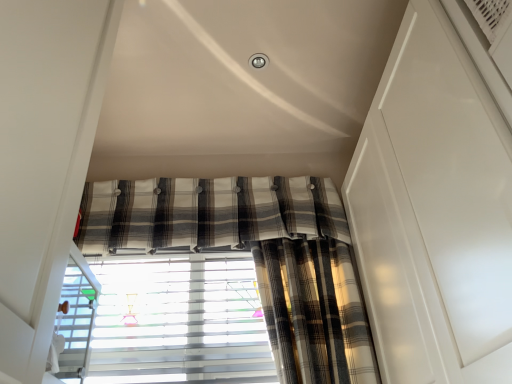
Question: From their relative heights in the image, would you say white textured blinds at center is taller or shorter than plaid fabric curtain at center?

Choices:
 (A) short
 (B) tall

Answer: (B)

Question: Looking at the image, does white textured blinds at center seem bigger or smaller compared to plaid fabric curtain at center?

Choices:
 (A) big
 (B) small

Answer: (B)

Question: Looking at their shapes, would you say white textured blinds at center is wider or thinner than plaid fabric curtain at center?

Choices:
 (A) wide
 (B) thin

Answer: (B)

Question: Looking at the image, does plaid fabric curtain at center seem bigger or smaller compared to white textured blinds at center?

Choices:
 (A) big
 (B) small

Answer: (A)

Question: Considering the relative positions of plaid fabric curtain at center and white textured blinds at center in the image provided, is plaid fabric curtain at center to the left or to the right of white textured blinds at center?

Choices:
 (A) right
 (B) left

Answer: (A)

Question: Considering the positions of plaid fabric curtain at center and white textured blinds at center in the image, is plaid fabric curtain at center taller or shorter than white textured blinds at center?

Choices:
 (A) tall
 (B) short

Answer: (B)

Question: Considering their positions, is plaid fabric curtain at center located in front of or behind white textured blinds at center?

Choices:
 (A) behind
 (B) front

Answer: (A)